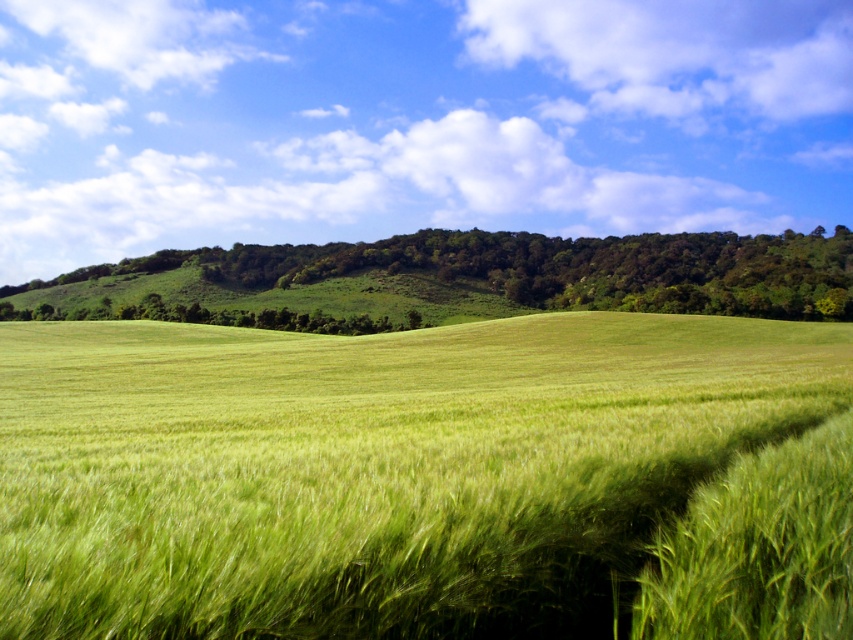
Question: Does green grassy field at center have a larger size compared to green grassy hillside at center?

Choices:
 (A) yes
 (B) no

Answer: (B)

Question: Is green grassy field at center above green grassy hillside at center?

Choices:
 (A) yes
 (B) no

Answer: (B)

Question: Which of the following is the closest to the observer?

Choices:
 (A) (48, 508)
 (B) (752, 237)

Answer: (A)

Question: Among these points, which one is nearest to the camera?

Choices:
 (A) (286, 337)
 (B) (398, 305)

Answer: (A)

Question: Does green grassy field at center appear on the left side of green grassy hillside at center?

Choices:
 (A) no
 (B) yes

Answer: (B)

Question: Which point is closer to the camera taking this photo?

Choices:
 (A) (236, 305)
 (B) (567, 573)

Answer: (B)